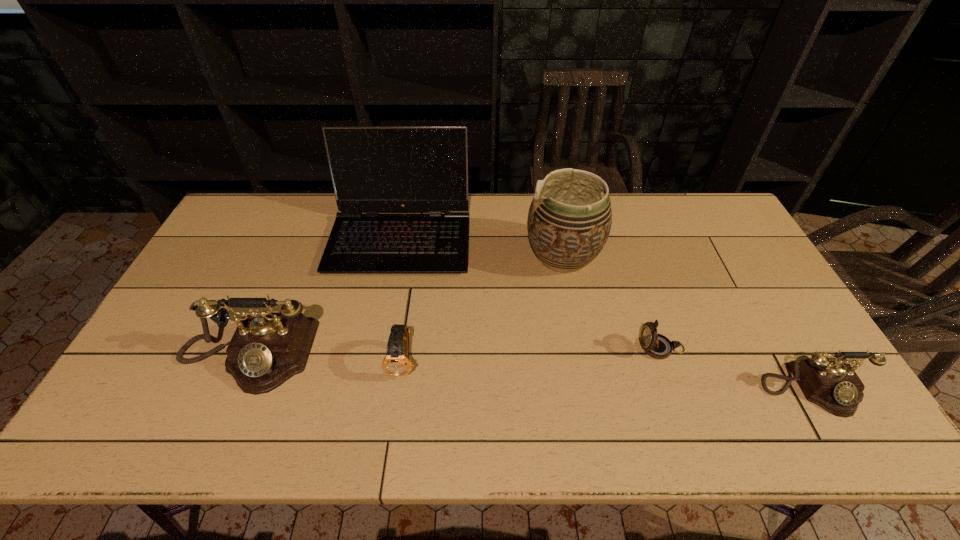
Where is `free space that is in between the rightmost object and the laptop computer`? free space that is in between the rightmost object and the laptop computer is located at coordinates (606, 314).

Locate an element on the screen. The height and width of the screenshot is (540, 960). vacant area that lies between the watch and the laptop computer is located at coordinates (402, 300).

This screenshot has height=540, width=960. I want to click on free space between the shorter telephone and the second object from right to left, so click(x=736, y=369).

Where is `vacant point located between the watch and the pottery`? This screenshot has height=540, width=960. vacant point located between the watch and the pottery is located at coordinates click(483, 309).

Locate an element on the screen. This screenshot has width=960, height=540. vacant region between the pottery and the second object from right to left is located at coordinates (612, 302).

I want to click on blank region between the watch and the fourth object from left to right, so click(483, 309).

This screenshot has height=540, width=960. I want to click on vacant area between the shorter telephone and the watch, so click(x=608, y=375).

Where is `object that ranks as the closest to the left telephone`? object that ranks as the closest to the left telephone is located at coordinates (374, 169).

Locate an element on the screen. This screenshot has width=960, height=540. object that is the second closest to the laptop computer is located at coordinates (569, 221).

Where is `vacant space that satisfies the following two spatial constraints: 1. on the screen of the third object from right to left; 2. on the left side of the laptop computer`? This screenshot has width=960, height=540. vacant space that satisfies the following two spatial constraints: 1. on the screen of the third object from right to left; 2. on the left side of the laptop computer is located at coordinates (396, 256).